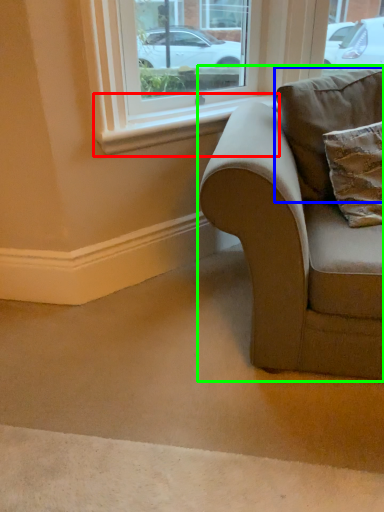
Question: Which object is the farthest from window sill (highlighted by a red box)? Choose among these: pillow (highlighted by a blue box) or studio couch (highlighted by a green box).

Choices:
 (A) pillow
 (B) studio couch

Answer: (B)